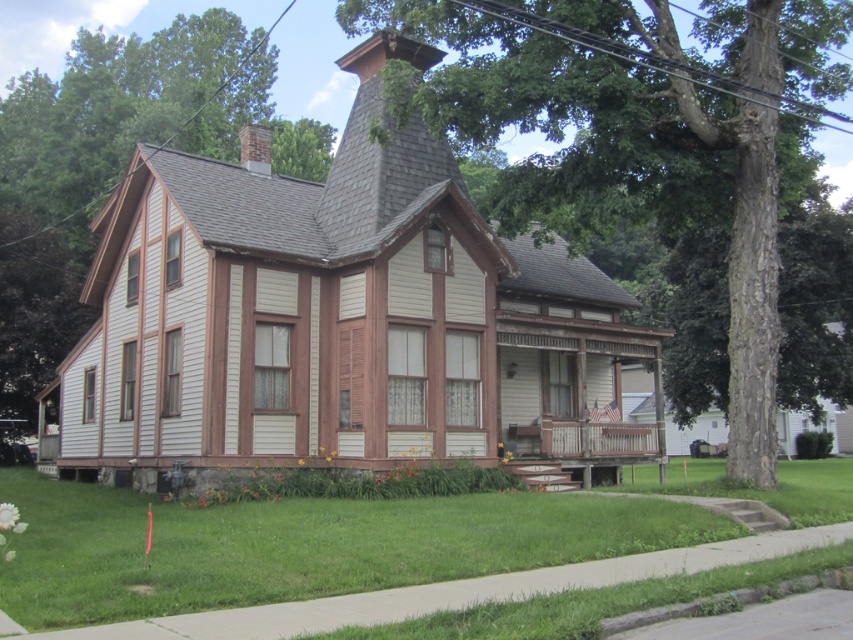
Who is more forward, (718, 80) or (155, 38)?

Point (718, 80) is in front.

Based on the photo, which is more to the right, smooth brown bark at center or green leafy tree at left?

smooth brown bark at center

This screenshot has width=853, height=640. Identify the location of smooth brown bark at center. (x=647, y=134).